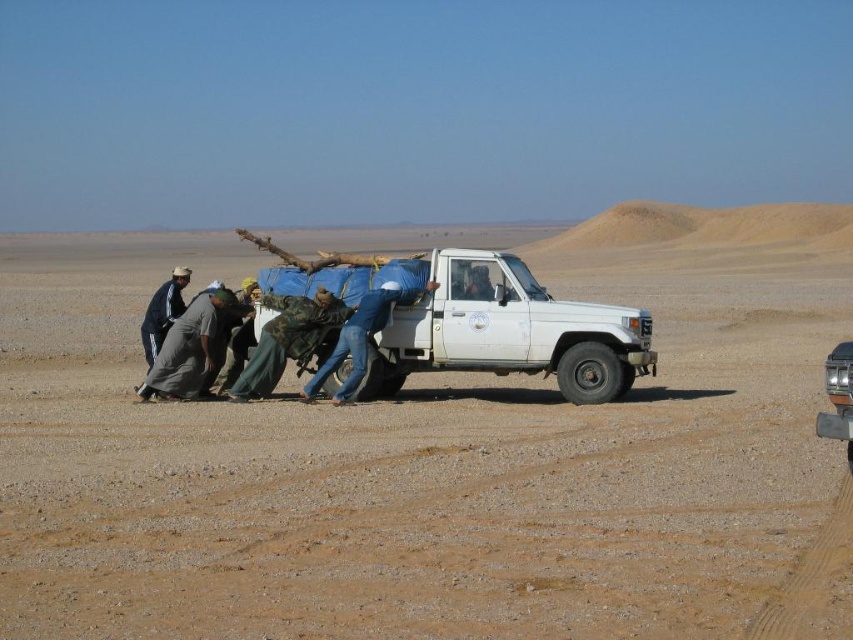
Question: Which point is closer to the camera taking this photo?

Choices:
 (A) (233, 396)
 (B) (488, 312)

Answer: (B)

Question: Does brown sandy dirt at center have a smaller size compared to matte blue jeans at center?

Choices:
 (A) no
 (B) yes

Answer: (A)

Question: Which point is closer to the camera?

Choices:
 (A) (265, 385)
 (B) (473, 266)
 (C) (686, 304)

Answer: (A)

Question: Does camouflage fabric pants at center appear over jeans at center?

Choices:
 (A) no
 (B) yes

Answer: (A)

Question: Among these points, which one is nearest to the camera?

Choices:
 (A) (173, 342)
 (B) (369, 307)

Answer: (B)

Question: Is gray fabric clothing at lower left closer to camera compared to matte blue jeans at center?

Choices:
 (A) no
 (B) yes

Answer: (B)